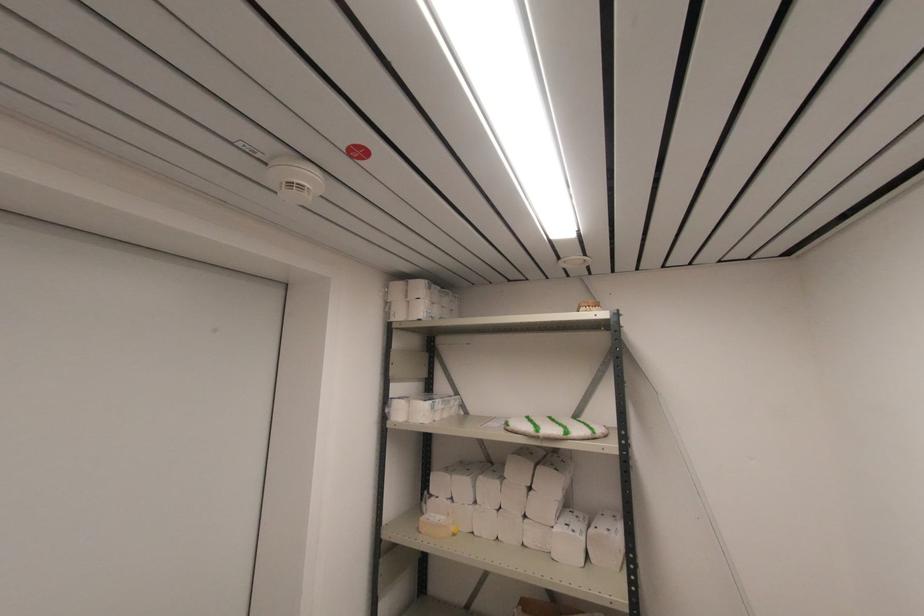
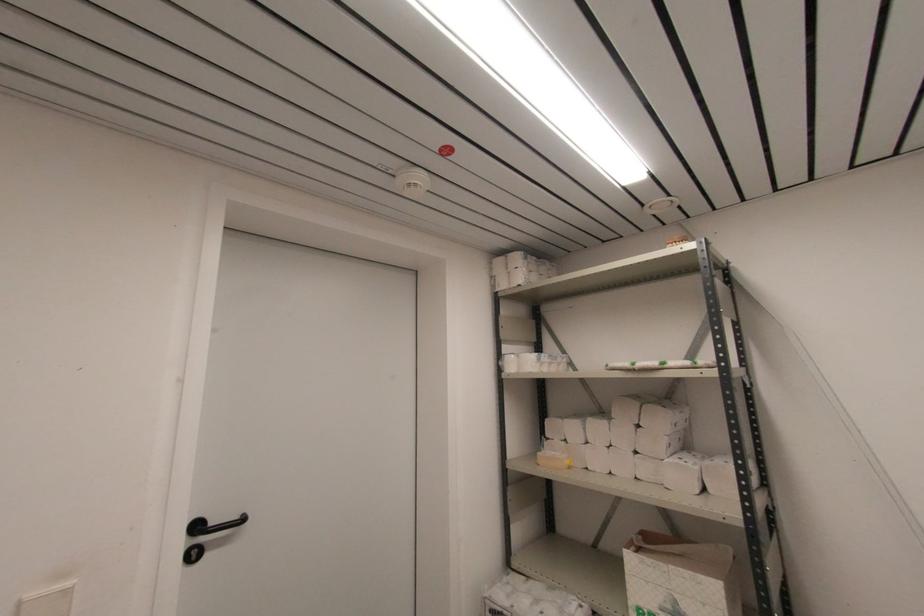
In the second image, find the point that corresponds to point (432, 493) in the first image.

(548, 436)